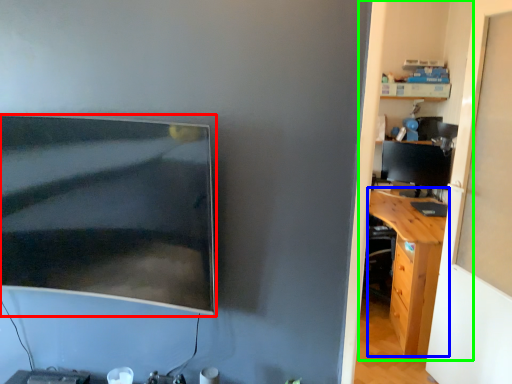
Question: Which is nearer to the computer monitor (highlighted by a red box)? desk (highlighted by a blue box) or dresser (highlighted by a green box).

Choices:
 (A) desk
 (B) dresser

Answer: (A)